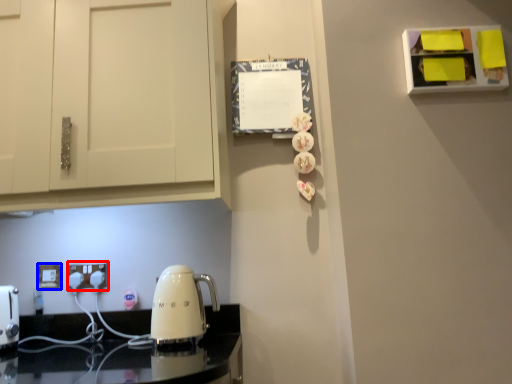
Question: Which of the following is the closest to the observer, electric outlet (highlighted by a red box) or electric outlet (highlighted by a blue box)?

Choices:
 (A) electric outlet
 (B) electric outlet

Answer: (A)